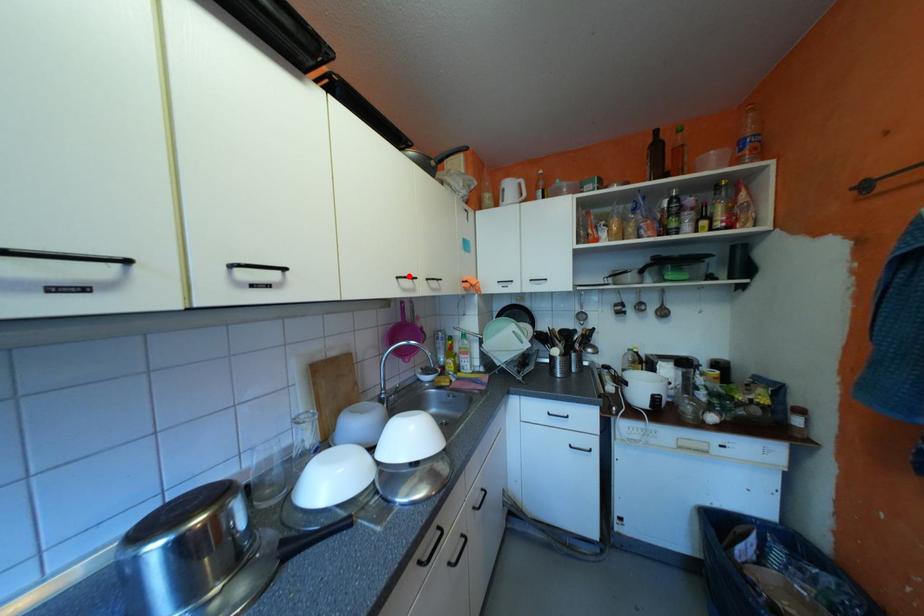
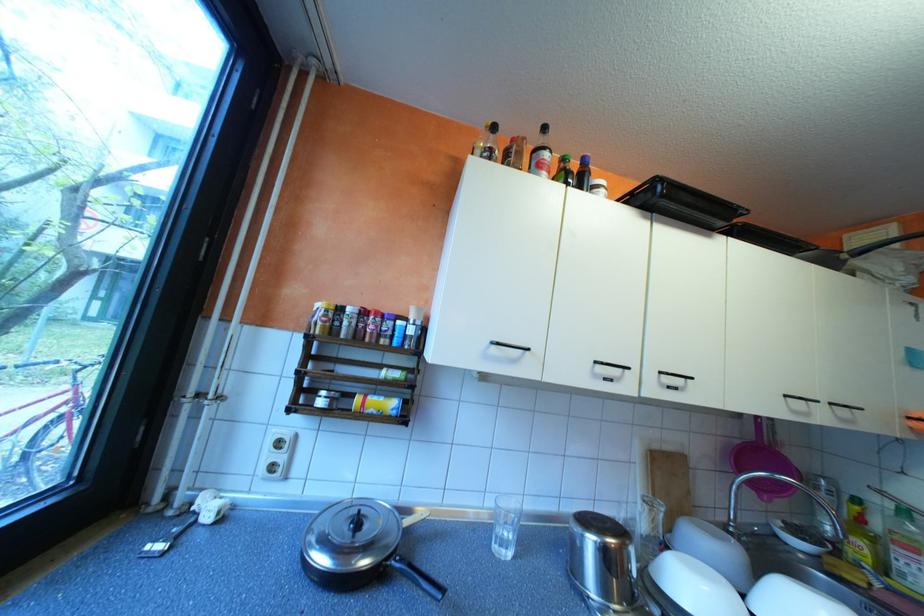
Find the pixel in the second image that matches the highlighted location in the first image.

(797, 395)